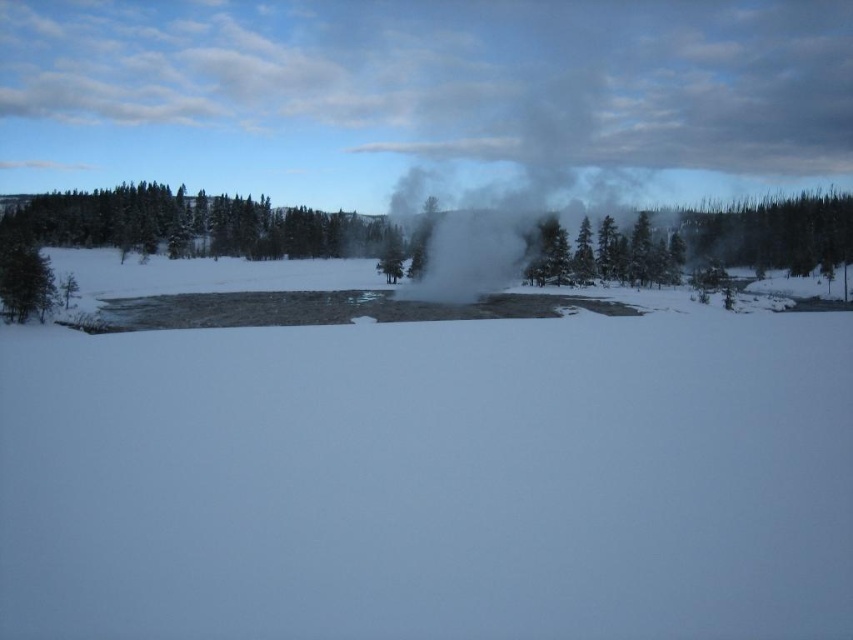
Question: Among these objects, which one is nearest to the camera?

Choices:
 (A) green matte tree at upper center
 (B) white vapor steam at center

Answer: (B)

Question: Is green matte tree at upper center wider than white vapor steam at center?

Choices:
 (A) yes
 (B) no

Answer: (A)

Question: Is green matte tree at upper center bigger than white vapor steam at center?

Choices:
 (A) yes
 (B) no

Answer: (B)

Question: Is green matte tree at upper center to the right of white vapor steam at center from the viewer's perspective?

Choices:
 (A) yes
 (B) no

Answer: (B)